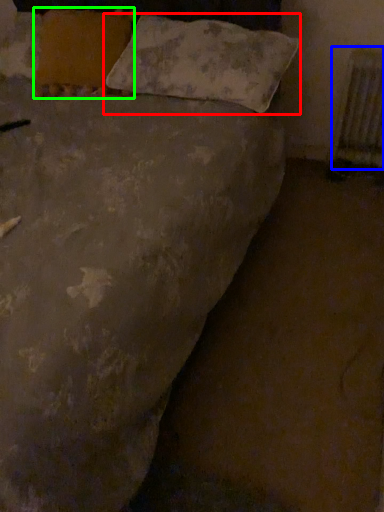
Question: Based on their relative distances, which object is nearer to pillow (highlighted by a red box)? Choose from radiator (highlighted by a blue box) and pillow (highlighted by a green box).

Choices:
 (A) radiator
 (B) pillow

Answer: (B)